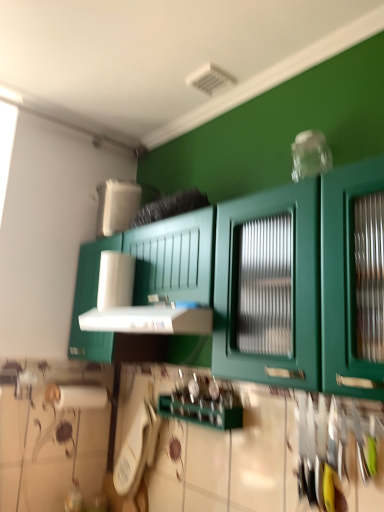
Question: From the image's perspective, is green matte cabinet at center located beneath white plastic phone at lower center?

Choices:
 (A) no
 (B) yes

Answer: (A)

Question: From a real-world perspective, is green matte cabinet at center beneath white plastic phone at lower center?

Choices:
 (A) yes
 (B) no

Answer: (B)

Question: Considering the relative positions of green matte cabinet at center and white plastic phone at lower center in the image provided, is green matte cabinet at center to the right of white plastic phone at lower center from the viewer's perspective?

Choices:
 (A) yes
 (B) no

Answer: (A)

Question: Are green matte cabinet at center and white plastic phone at lower center located far from each other?

Choices:
 (A) no
 (B) yes

Answer: (A)

Question: Is green matte cabinet at center at the left side of white plastic phone at lower center?

Choices:
 (A) yes
 (B) no

Answer: (B)

Question: Is white plastic phone at lower center completely or partially inside green matte cabinet at center?

Choices:
 (A) yes
 (B) no

Answer: (B)

Question: From a real-world perspective, does white plastic phone at lower center stand above white plastic vent at center?

Choices:
 (A) yes
 (B) no

Answer: (B)

Question: Considering the relative sizes of white plastic phone at lower center and white plastic vent at center in the image provided, is white plastic phone at lower center taller than white plastic vent at center?

Choices:
 (A) yes
 (B) no

Answer: (A)

Question: Would you consider white plastic phone at lower center to be distant from white plastic vent at center?

Choices:
 (A) yes
 (B) no

Answer: (B)

Question: Is white plastic vent at center inside white plastic phone at lower center?

Choices:
 (A) no
 (B) yes

Answer: (A)

Question: Considering the relative sizes of white plastic phone at lower center and white plastic vent at center in the image provided, is white plastic phone at lower center smaller than white plastic vent at center?

Choices:
 (A) yes
 (B) no

Answer: (A)

Question: Is white plastic phone at lower center next to white plastic vent at center?

Choices:
 (A) yes
 (B) no

Answer: (B)

Question: Is white plastic vent at center far from white plastic phone at lower center?

Choices:
 (A) yes
 (B) no

Answer: (B)